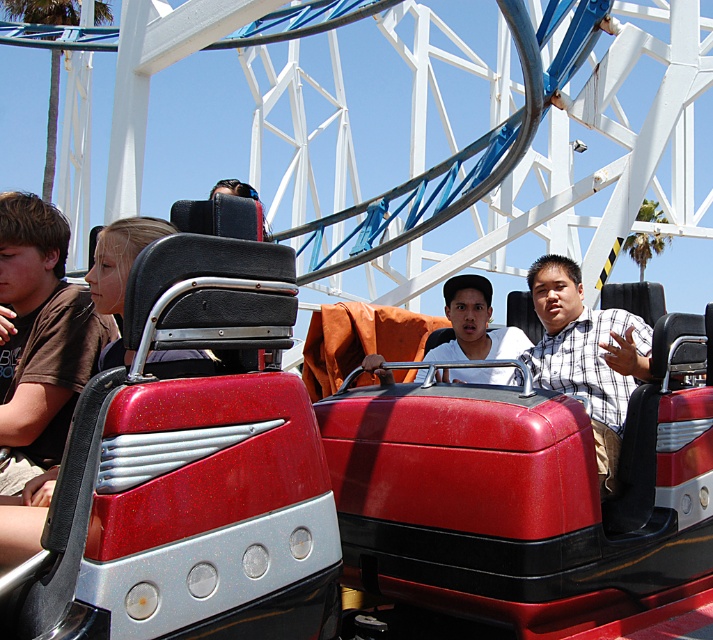
Between brown cotton shirt at left and checkered fabric shirt at center, which one appears on the left side from the viewer's perspective?

From the viewer's perspective, brown cotton shirt at left appears more on the left side.

Looking at this image, is brown cotton shirt at left below checkered fabric shirt at center?

No, brown cotton shirt at left is not below checkered fabric shirt at center.

The height and width of the screenshot is (640, 713). I want to click on brown cotton shirt at left, so click(x=41, y=333).

What are the coordinates of `brown cotton shirt at left` in the screenshot? It's located at (41, 333).

Is checkered fabric shirt at center thinner than white matte shirt at center?

No, checkered fabric shirt at center is not thinner than white matte shirt at center.

Is checkered fabric shirt at center closer to the viewer compared to white matte shirt at center?

That is True.

Identify the location of checkered fabric shirt at center. This screenshot has height=640, width=713. point(585,355).

Where is `checkered fabric shirt at center`? This screenshot has width=713, height=640. checkered fabric shirt at center is located at coordinates (585, 355).

Between brown cotton shirt at left and white matte shirt at center, which one is positioned lower?

brown cotton shirt at left is lower down.

Does brown cotton shirt at left have a lesser height compared to white matte shirt at center?

No.

Identify the location of brown cotton shirt at left. (41, 333).

Where is `brown cotton shirt at left`? The width and height of the screenshot is (713, 640). brown cotton shirt at left is located at coordinates (41, 333).